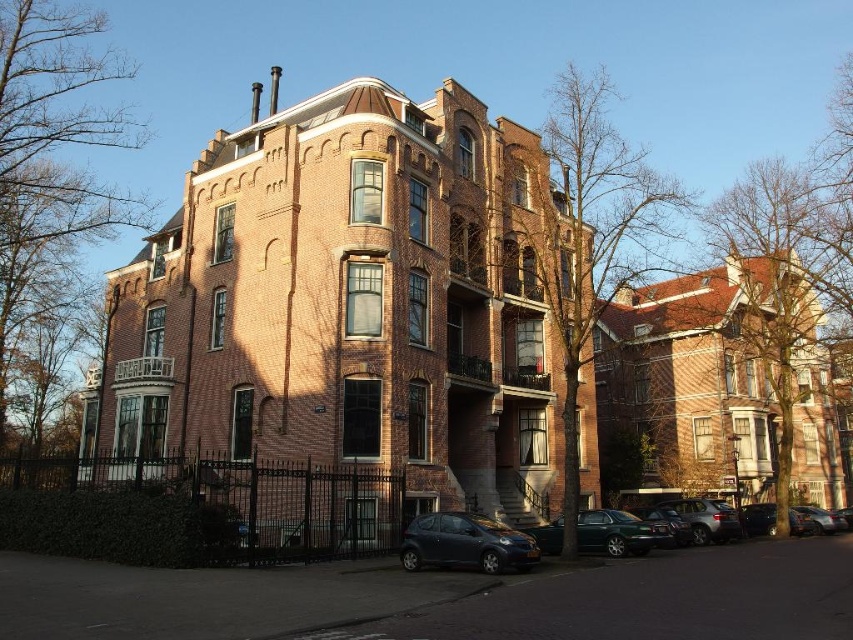
The width and height of the screenshot is (853, 640). I want to click on matte black car at lower center, so click(x=474, y=541).

Find the location of `matte black car at lower center`. matte black car at lower center is located at coordinates (474, 541).

Consider the image. How far apart are matte black car at lower center and metallic gray hatchback at lower center?

They are 3.08 meters apart.

This screenshot has height=640, width=853. What do you see at coordinates (474, 541) in the screenshot? I see `matte black car at lower center` at bounding box center [474, 541].

Locate an element on the screen. This screenshot has width=853, height=640. matte black car at lower center is located at coordinates (474, 541).

Between point (445, 545) and point (537, 532), which one is positioned in front?

Positioned in front is point (445, 545).

Identify the location of metallic gray hatchback at lower center. (466, 544).

Image resolution: width=853 pixels, height=640 pixels. Identify the location of metallic gray hatchback at lower center. (466, 544).